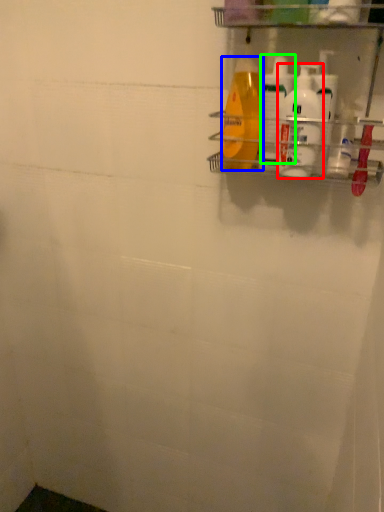
Question: Estimate the real-world distances between objects in this image. Which object is closer to cleaning product (highlighted by a red box), cleaning product (highlighted by a blue box) or cleaning product (highlighted by a green box)?

Choices:
 (A) cleaning product
 (B) cleaning product

Answer: (B)